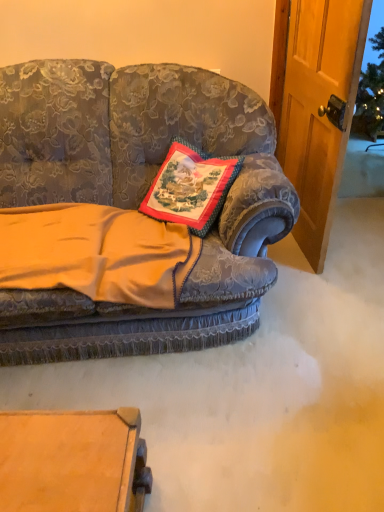
Question: Is velvet gold blanket at center taller or shorter than velvet floral couch at center?

Choices:
 (A) tall
 (B) short

Answer: (B)

Question: Is velvet gold blanket at center inside the boundaries of velvet floral couch at center, or outside?

Choices:
 (A) inside
 (B) outside

Answer: (A)

Question: Based on their relative distances, which object is farther from the embroidered fabric pillow at center?

Choices:
 (A) velvet gold blanket at center
 (B) velvet floral couch at center

Answer: (A)

Question: Which object is positioned farthest from the embroidered fabric pillow at center?

Choices:
 (A) velvet gold blanket at center
 (B) velvet floral couch at center

Answer: (A)